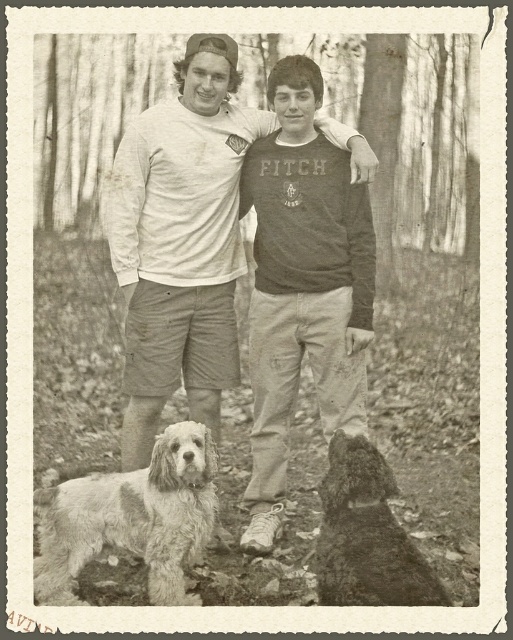
Question: Which object appears closest to the camera in this image?

Choices:
 (A) white cotton shirt at center
 (B) shaggy dark fur dog at lower right
 (C) dark gray cotton shirt at center

Answer: (B)

Question: Can you confirm if fuzzy fur dog at lower left is bigger than shaggy dark fur dog at lower right?

Choices:
 (A) yes
 (B) no

Answer: (A)

Question: Which is farther from the fuzzy fur dog at lower left?

Choices:
 (A) white cotton shirt at center
 (B) dark gray cotton shirt at center
 (C) shaggy dark fur dog at lower right

Answer: (B)

Question: Can you confirm if white cotton shirt at center is bigger than fuzzy fur dog at lower left?

Choices:
 (A) no
 (B) yes

Answer: (B)

Question: Which of the following is the closest to the observer?

Choices:
 (A) (300, 84)
 (B) (228, 364)

Answer: (A)

Question: Is white cotton shirt at center closer to camera compared to shaggy dark fur dog at lower right?

Choices:
 (A) yes
 (B) no

Answer: (B)